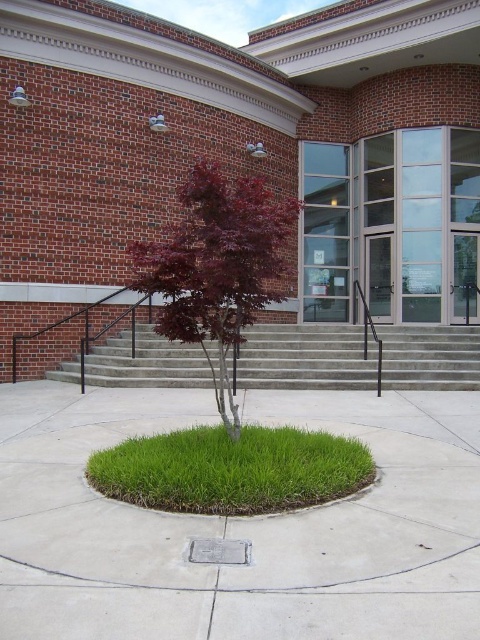
Is green concrete at center smaller than green grass at center?

Correct, green concrete at center occupies less space than green grass at center.

Which is more to the right, green concrete at center or green grass at center?

green concrete at center

Which is in front, point (346, 556) or point (213, 461)?

Point (346, 556) is in front.

Locate an element on the screen. Image resolution: width=480 pixels, height=640 pixels. green concrete at center is located at coordinates (240, 524).

Between point (208, 282) and point (217, 557), which one is positioned in front?

Positioned in front is point (217, 557).

Consider the image. Who is positioned more to the right, glossy red tree at center or metallic plaque at center?

metallic plaque at center is more to the right.

Find the location of a particular element. This screenshot has width=480, height=640. glossy red tree at center is located at coordinates 217,266.

Is point (176, 602) positioned before point (232, 541)?

Yes, point (176, 602) is in front of point (232, 541).

Who is positioned more to the left, green concrete at center or metallic plaque at center?

metallic plaque at center

This screenshot has width=480, height=640. What are the coordinates of `green concrete at center` in the screenshot? It's located at (240, 524).